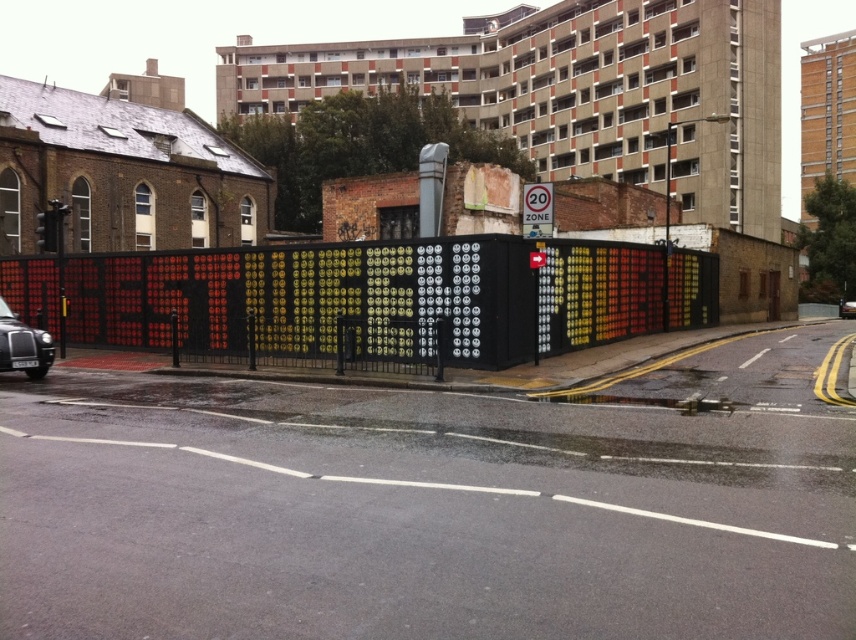
Question: Among these points, which one is nearest to the camera?

Choices:
 (A) (3, 314)
 (B) (538, 186)
 (C) (682, 310)
 (D) (842, 310)

Answer: (B)

Question: Can you confirm if metallic black fence at center is positioned to the left of black metallic car at left?

Choices:
 (A) no
 (B) yes

Answer: (A)

Question: Which of the following is the closest to the observer?

Choices:
 (A) metallic black fence at center
 (B) black metallic car at center
 (C) black metallic car at left
 (D) metallic rectangular sign at center

Answer: (C)

Question: Is metallic black fence at center thinner than black metallic car at center?

Choices:
 (A) yes
 (B) no

Answer: (B)

Question: Which object is the closest to the metallic black fence at center?

Choices:
 (A) metallic rectangular sign at center
 (B) black metallic car at left

Answer: (A)

Question: Can you confirm if black metallic car at left is wider than metallic rectangular sign at center?

Choices:
 (A) yes
 (B) no

Answer: (A)